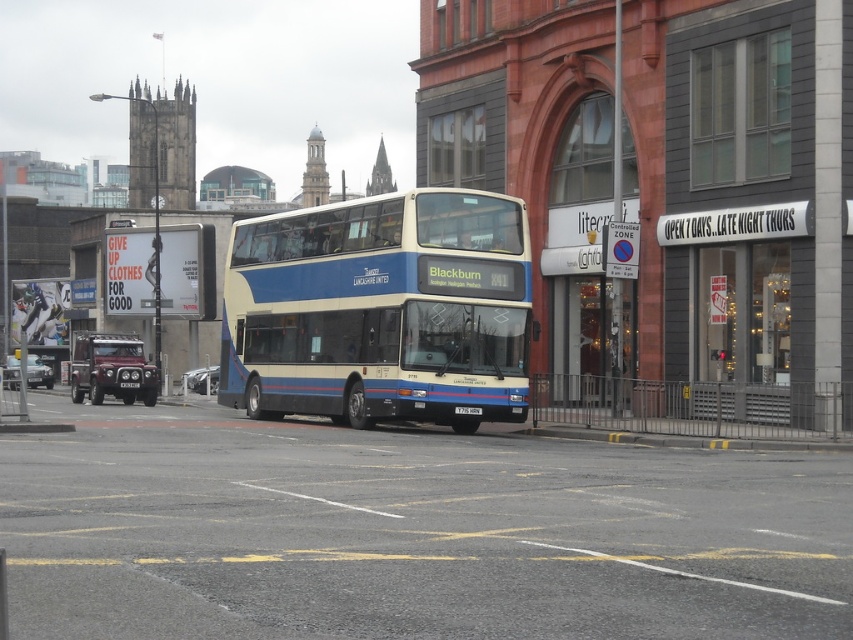
You are a delivery driver who needs to park your 5.5 meter long truck between the metallic silver car at lower left and the black plastic license plate at center. Is there enough space?

The metallic silver car at lower left and black plastic license plate at center are 25.79 meters apart. Since your truck is only 5.5 meters long, there is more than enough space to park between them.

You are standing on the sidewalk and see two points marked on the road ahead. The first point is at coordinates point (26, 376) and the second is at point (187, 376). Which point is closer to you?

Point (26, 376) is closer to the viewer than point (187, 376).